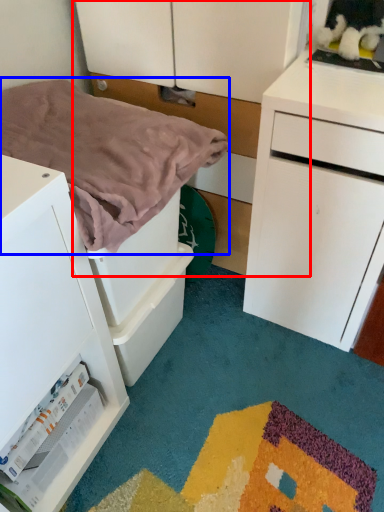
Question: Which object is closer to the camera taking this photo, dresser (highlighted by a red box) or blanket (highlighted by a blue box)?

Choices:
 (A) dresser
 (B) blanket

Answer: (B)